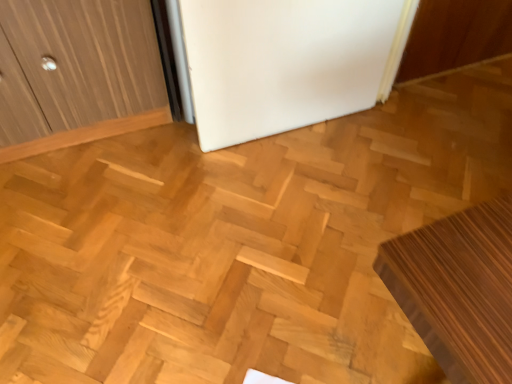
Question: In terms of width, does white matte refrigerator at center look wider or thinner when compared to wooden bench at lower right?

Choices:
 (A) wide
 (B) thin

Answer: (B)

Question: Considering the positions of white matte refrigerator at center and wooden bench at lower right in the image, is white matte refrigerator at center bigger or smaller than wooden bench at lower right?

Choices:
 (A) big
 (B) small

Answer: (B)

Question: Is white matte refrigerator at center in front of or behind wooden bench at lower right in the image?

Choices:
 (A) front
 (B) behind

Answer: (B)

Question: From their relative heights in the image, would you say wooden bench at lower right is taller or shorter than white matte refrigerator at center?

Choices:
 (A) tall
 (B) short

Answer: (B)

Question: In the image, is wooden bench at lower right positioned in front of or behind white matte refrigerator at center?

Choices:
 (A) behind
 (B) front

Answer: (B)

Question: Is wooden bench at lower right wider or thinner than white matte refrigerator at center?

Choices:
 (A) thin
 (B) wide

Answer: (B)

Question: From a real-world perspective, relative to white matte refrigerator at center, is wooden bench at lower right vertically above or below?

Choices:
 (A) below
 (B) above

Answer: (A)